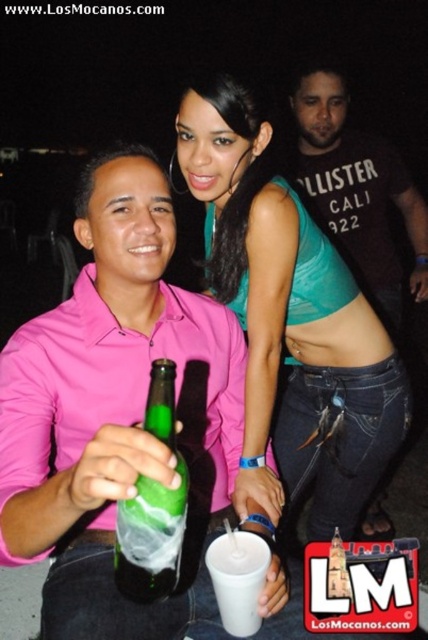
The height and width of the screenshot is (640, 428). Find the location of `matte green glass bottle at center`. matte green glass bottle at center is located at coordinates (115, 410).

Is point (65, 579) farther from viewer compared to point (243, 552)?

Yes, it is behind point (243, 552).

Is point (240, 349) in front of point (252, 588)?

No.

What are the coordinates of `matte green glass bottle at center` in the screenshot? It's located at [x=115, y=410].

From the picture: Who is more forward, (256, 195) or (163, 573)?

Positioned in front is point (163, 573).

Where is `teal fabric top at upper center`? The height and width of the screenshot is (640, 428). teal fabric top at upper center is located at coordinates (291, 321).

Can you confirm if green glass bottle at center is thinner than white plastic cup at center?

Correct, green glass bottle at center's width is less than white plastic cup at center's.

Measure the distance between point (171,547) and camera.

24.87 inches

Find the location of a particular element. green glass bottle at center is located at coordinates click(152, 506).